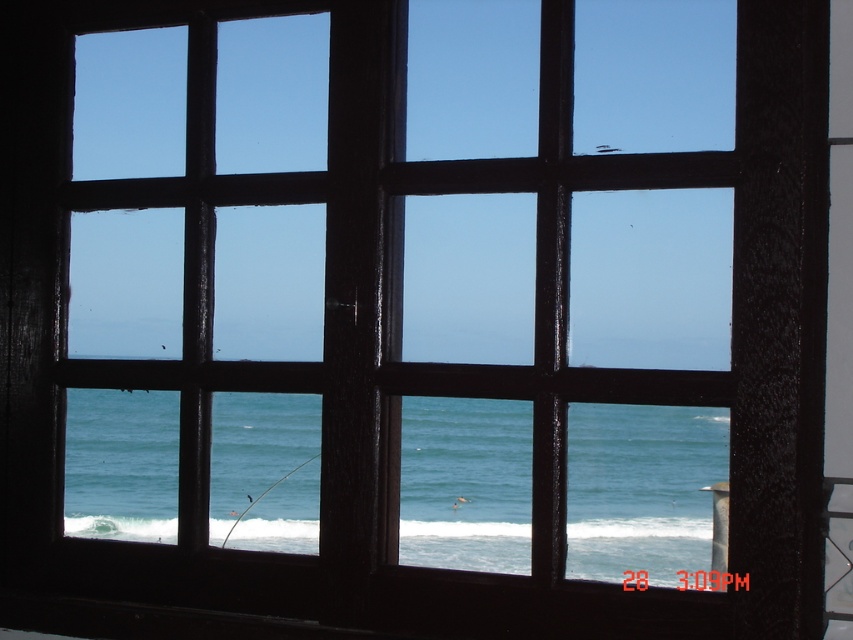
Question: Which object is farther from the camera taking this photo?

Choices:
 (A) white frothy wave at lower center
 (B) blue water at center

Answer: (A)

Question: Can you confirm if blue water at center is wider than white frothy wave at lower center?

Choices:
 (A) no
 (B) yes

Answer: (B)

Question: Which point is closer to the camera?

Choices:
 (A) blue water at center
 (B) white frothy wave at lower center

Answer: (A)

Question: Is blue water at center positioned at the back of white frothy wave at lower center?

Choices:
 (A) no
 (B) yes

Answer: (A)

Question: Is blue water at center to the left of white frothy wave at lower center from the viewer's perspective?

Choices:
 (A) no
 (B) yes

Answer: (A)